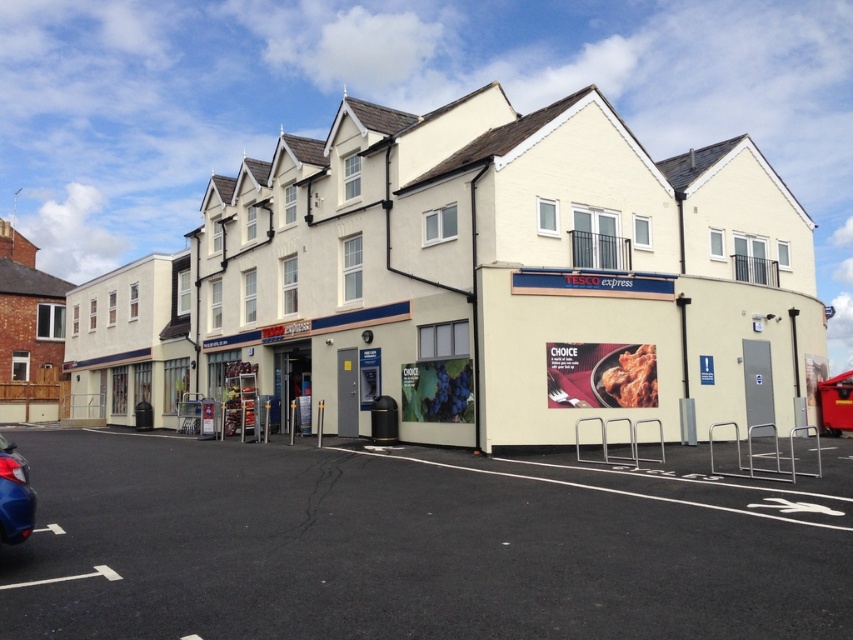
Question: Which of the following is the closest to the observer?

Choices:
 (A) (12, 451)
 (B) (804, 524)

Answer: (A)

Question: Which object is farther from the camera taking this photo?

Choices:
 (A) metallic blue car at lower left
 (B) black asphalt parking lot at lower center

Answer: (A)

Question: Is black asphalt parking lot at lower center smaller than metallic blue car at lower left?

Choices:
 (A) no
 (B) yes

Answer: (A)

Question: Does black asphalt parking lot at lower center have a lesser width compared to metallic blue car at lower left?

Choices:
 (A) no
 (B) yes

Answer: (A)

Question: Is black asphalt parking lot at lower center to the left of metallic blue car at lower left from the viewer's perspective?

Choices:
 (A) no
 (B) yes

Answer: (A)